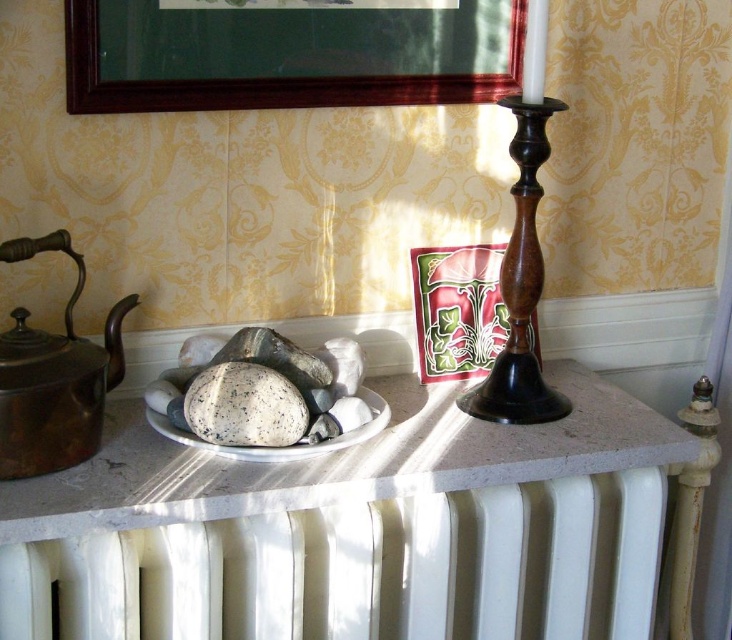
You are standing in the room depicted in the image. There is a point marked at coordinates (x=362, y=570). What object is located at this point?

The point at coordinates (x=362, y=570) marks the white painted radiator at lower center.

You are standing in the room and want to locate the white painted radiator at lower center. According to the coordinates provided, where would you find it?

The white painted radiator at lower center is located at point (362, 570).

You are setting up a tea service in the room. You have a shiny brass teapot at left and a speckled stone plate at center. Which object should you place the tea leaves on if you want to ensure they are visible from across the room?

The speckled stone plate at center should be used to place the tea leaves because it is smaller and more likely to be noticed from a distance compared to the larger shiny brass teapot at left.